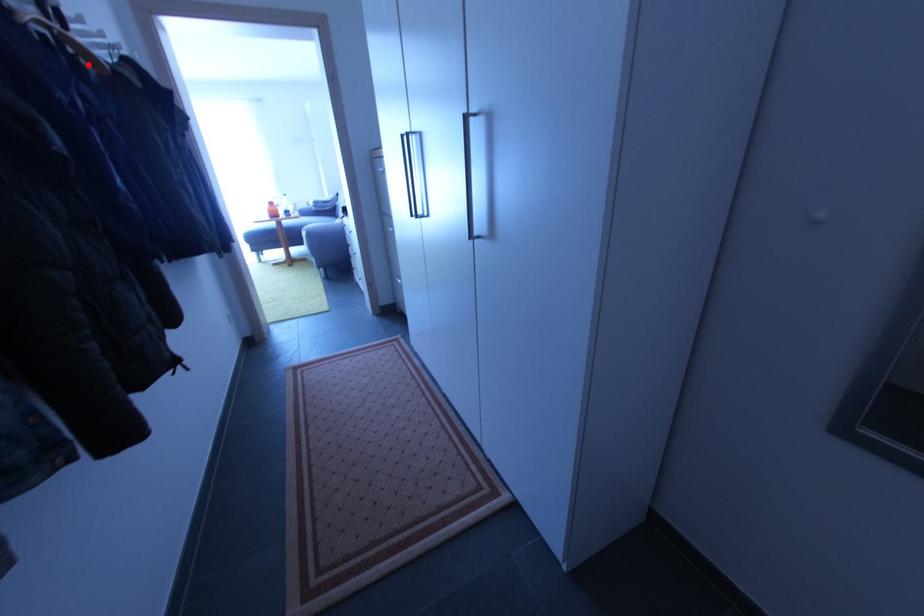
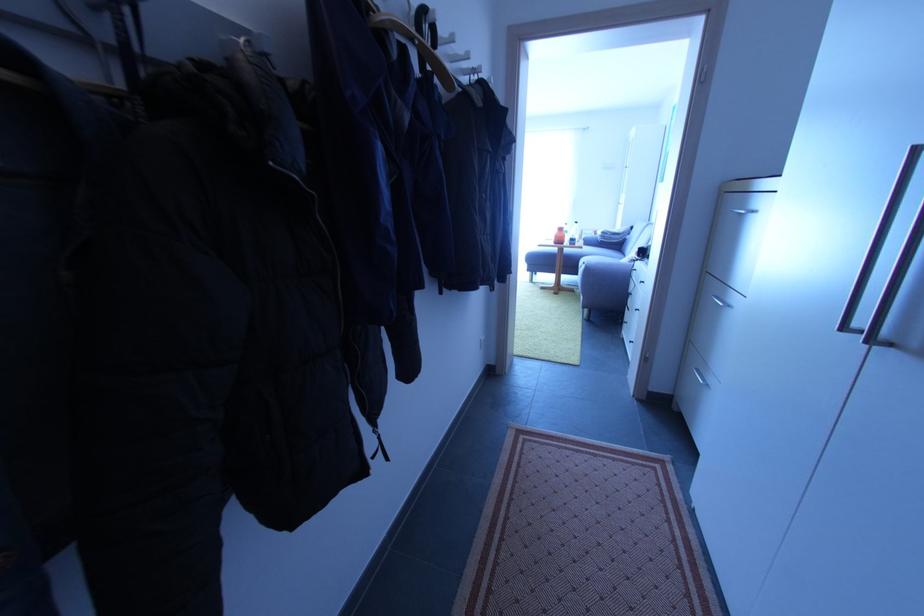
Where in the second image is the point corresponding to the highlighted location from the first image?

(441, 82)